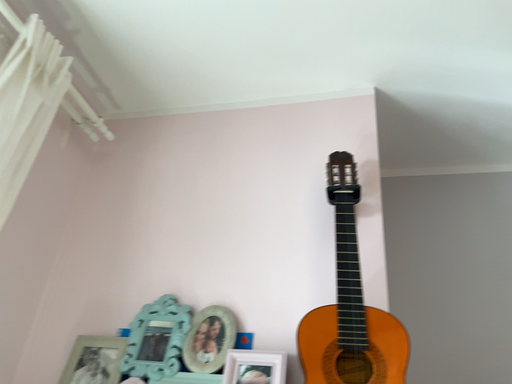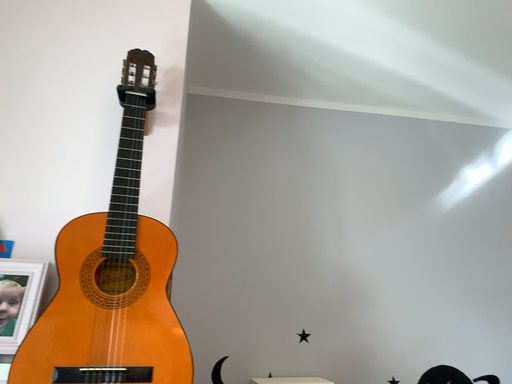
Question: How did the camera likely rotate when shooting the video?

Choices:
 (A) rotated right
 (B) rotated left

Answer: (A)